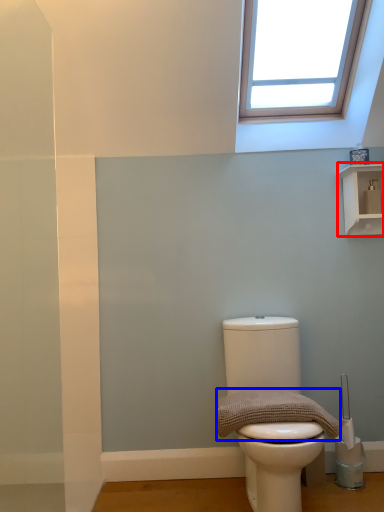
Question: Which object is closer to the camera taking this photo, shelf (highlighted by a red box) or material (highlighted by a blue box)?

Choices:
 (A) shelf
 (B) material

Answer: (B)